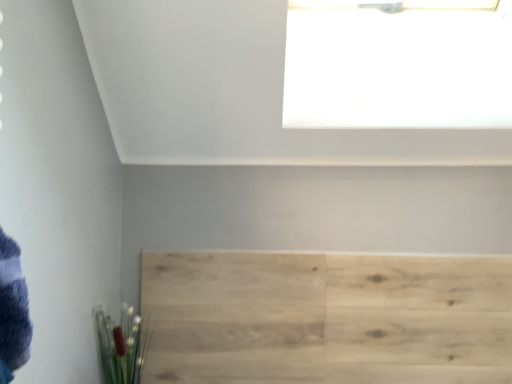
The width and height of the screenshot is (512, 384). Describe the element at coordinates (326, 318) in the screenshot. I see `light wood drawer at lower center` at that location.

Where is `light wood drawer at lower center`? light wood drawer at lower center is located at coordinates (326, 318).

Where is `light wood drawer at lower center`? light wood drawer at lower center is located at coordinates (326, 318).